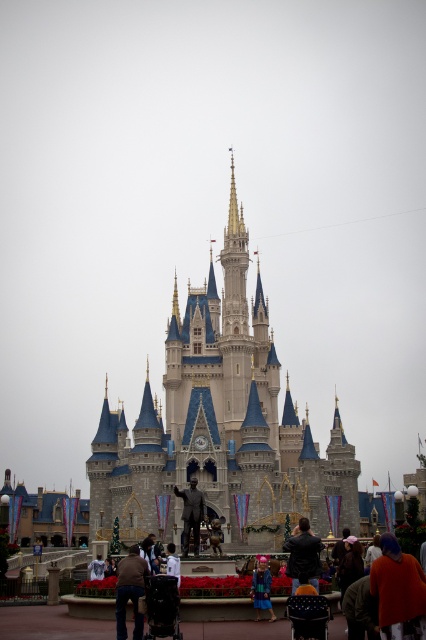
Looking at this image, who is shorter, polished bronze statue at center or bronze statue at center?

bronze statue at center is shorter.

You are a GUI agent. You are given a task and a screenshot of the screen. Output one action in this format:
    pyautogui.click(x=<x>, y=<y>)
    Task: Click on the polished bronze statue at center
    
    Given the screenshot: What is the action you would take?
    pyautogui.click(x=192, y=515)

Is point (227, 449) farther from viewer compared to point (206, 524)?

Yes, point (227, 449) is farther from viewer.

Is point (218, 371) closer to camera compared to point (210, 540)?

No, it is not.

At what (x,y) coordinates should I click in order to perform the action: click on light gray stone castle at center. Please return your answer as a coordinate pair (x, y). The width and height of the screenshot is (426, 640). Looking at the image, I should click on (219, 426).

Can you confirm if brown leather jacket at lower left is taller than blue velvet coat at lower center?

Yes.

Which is behind, point (117, 573) or point (264, 580)?

Positioned behind is point (117, 573).

You are a GUI agent. You are given a task and a screenshot of the screen. Output one action in this format:
    pyautogui.click(x=<x>, y=<y>)
    Task: Click on the brown leather jacket at lower left
    
    Given the screenshot: What is the action you would take?
    pyautogui.click(x=129, y=589)